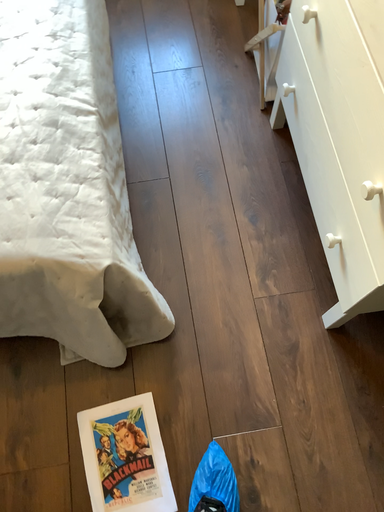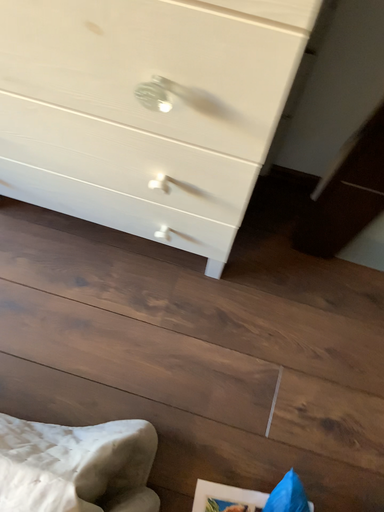
Question: Which way did the camera rotate in the video?

Choices:
 (A) rotated right
 (B) rotated left

Answer: (A)